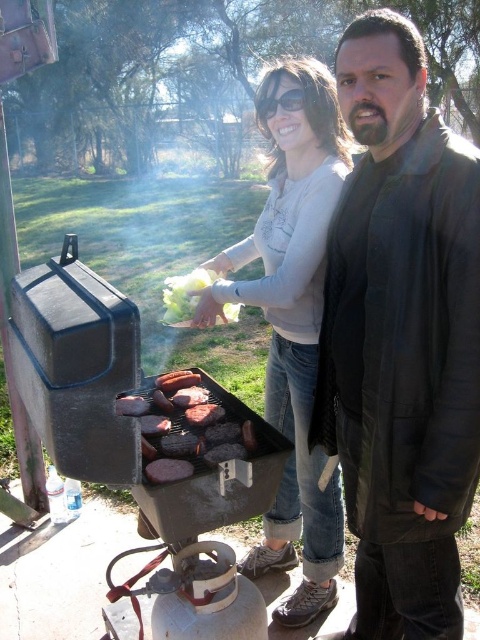
Question: Does charred meat at center lie in front of brown charred meat at center?

Choices:
 (A) no
 (B) yes

Answer: (B)

Question: Which point is closer to the camera taking this photo?

Choices:
 (A) (227, 316)
 (B) (176, 474)
 (C) (396, 156)

Answer: (C)

Question: Which object is the farthest from the charred meat at center?

Choices:
 (A) translucent yellow plastic bag at center
 (B) black leather jacket at right
 (C) brown charred meat at center

Answer: (B)

Question: Is black leather jacket at right wider than matte white sweater at center?

Choices:
 (A) no
 (B) yes

Answer: (A)

Question: Which of these objects is positioned farthest from the black plastic sunglasses at upper center?

Choices:
 (A) matte white sweater at center
 (B) black leather jacket at right
 (C) translucent yellow plastic bag at center
 (D) brown charred meat at center

Answer: (D)

Question: Can you confirm if matte white sweater at center is positioned to the left of brown charred meat at center?

Choices:
 (A) yes
 (B) no

Answer: (B)